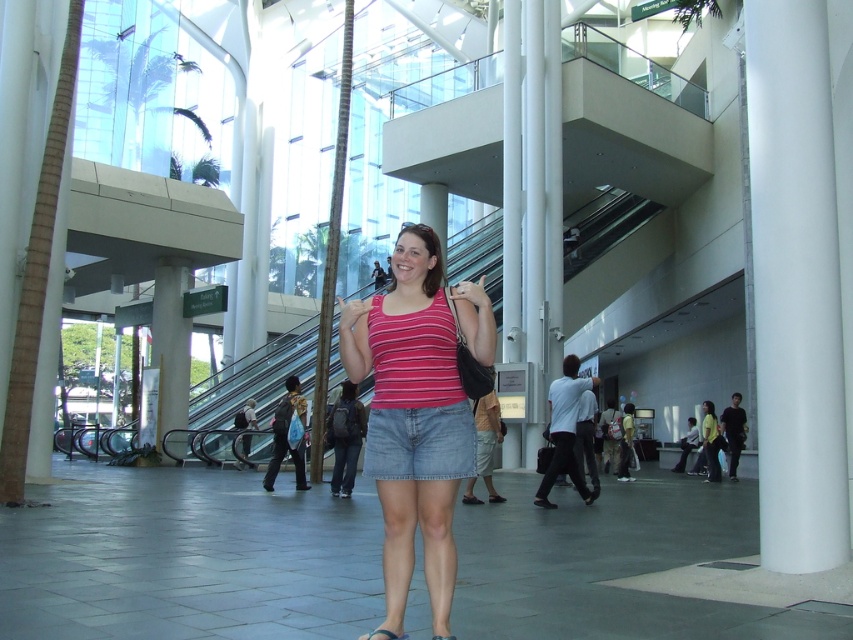
Question: Which point is farther to the camera?

Choices:
 (A) (595, 228)
 (B) (560, 472)

Answer: (A)

Question: Is metallic silver escalator at center to the left of denim shorts at center from the viewer's perspective?

Choices:
 (A) yes
 (B) no

Answer: (A)

Question: Can you confirm if metallic silver escalator at center is positioned below white cotton shirt at center?

Choices:
 (A) no
 (B) yes

Answer: (A)

Question: Does metallic silver escalator at center have a larger size compared to leather-like brown sandal at lower center?

Choices:
 (A) no
 (B) yes

Answer: (B)

Question: Which point is farther to the camera?

Choices:
 (A) white cotton shirt at center
 (B) metallic silver escalator at center
 (C) striped cotton tank top at center
 (D) white smooth column at right

Answer: (B)

Question: Which point is farther to the camera?

Choices:
 (A) leather-like brown sandal at lower center
 (B) white smooth column at right

Answer: (B)